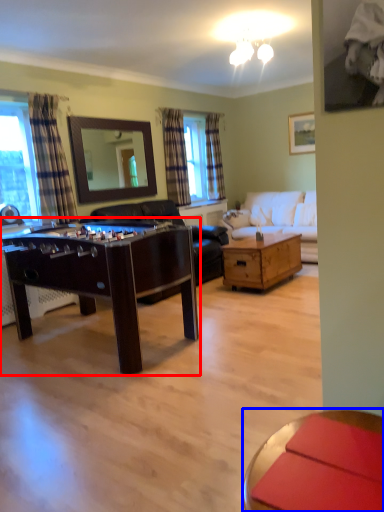
Question: Which of the following is the closest to the observer, table (highlighted by a red box) or coffee table (highlighted by a blue box)?

Choices:
 (A) table
 (B) coffee table

Answer: (B)